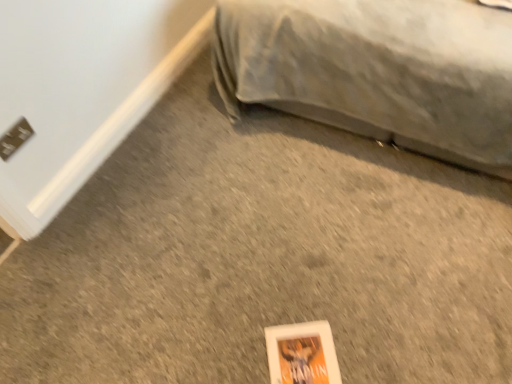
Where is `spots to the right of white matte paperback book at lower center`? The height and width of the screenshot is (384, 512). spots to the right of white matte paperback book at lower center is located at coordinates (366, 342).